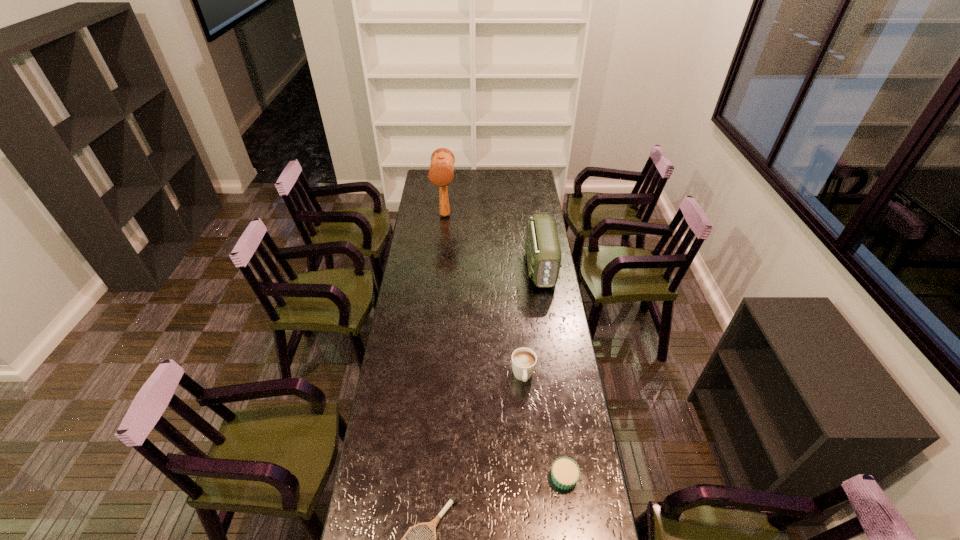
Find the location of a particular element. This screenshot has height=540, width=960. blank region between the second tallest object and the third shortest object is located at coordinates (532, 321).

The image size is (960, 540). Find the location of `vacant point located between the mallet and the second shortest object`. vacant point located between the mallet and the second shortest object is located at coordinates (504, 346).

Point out which object is positioned as the nearest to the radio_receiver. Please provide its 2D coordinates. Your answer should be formatted as a tuple, i.e. [(x, y)], where the tuple contains the x and y coordinates of a point satisfying the conditions above.

[(441, 170)]

You are a GUI agent. You are given a task and a screenshot of the screen. Output one action in this format:
    pyautogui.click(x=<x>, y=<y>)
    Task: Click on the second closest object to the third farthest object
    The width and height of the screenshot is (960, 540).
    Given the screenshot: What is the action you would take?
    pyautogui.click(x=542, y=246)

This screenshot has height=540, width=960. In order to click on free space that satisfies the following two spatial constraints: 1. with the handle on the side of the cappuccino; 2. on the right side of the fourth farthest object in this screenshot , I will do click(x=532, y=477).

I want to click on free spot that satisfies the following two spatial constraints: 1. with the handle on the side of the cupcake; 2. on the right side of the third object from right to left, so click(x=532, y=477).